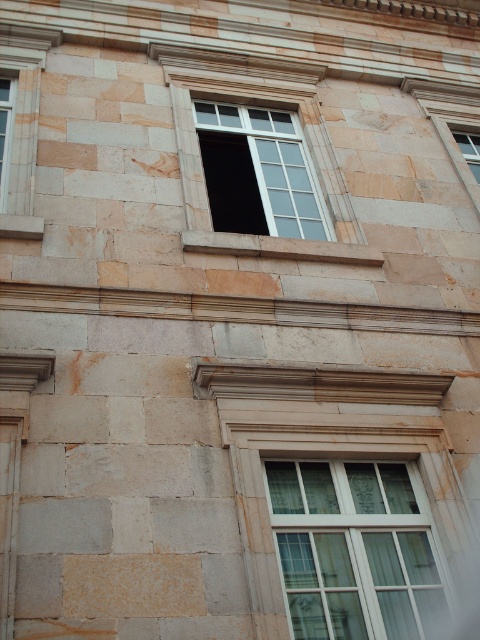
Question: Is clear glass window at center bigger than transparent glass window at upper center?

Choices:
 (A) yes
 (B) no

Answer: (B)

Question: Which is farther from the transparent glass window at upper center?

Choices:
 (A) clear glass window at upper right
 (B) clear glass window at center

Answer: (B)

Question: Based on their relative distances, which object is farther from the clear glass window at center?

Choices:
 (A) clear glass window at upper right
 (B) transparent glass window at upper center

Answer: (A)

Question: Does clear glass window at center appear on the right side of clear glass window at upper right?

Choices:
 (A) yes
 (B) no

Answer: (B)

Question: Which object is positioned farthest from the clear glass window at upper right?

Choices:
 (A) clear glass window at center
 (B) transparent glass window at upper center

Answer: (A)

Question: In this image, where is clear glass window at center located relative to clear glass window at upper right?

Choices:
 (A) above
 (B) below

Answer: (B)